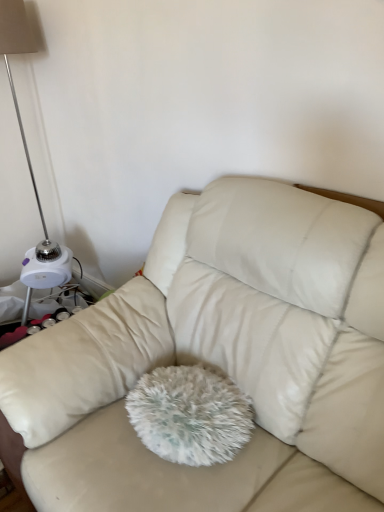
Question: In the image, is beige leather couch at center positioned in front of or behind white plastic lamp at left?

Choices:
 (A) behind
 (B) front

Answer: (B)

Question: Does point (269, 478) appear closer or farther from the camera than point (44, 268)?

Choices:
 (A) closer
 (B) farther

Answer: (A)

Question: From a real-world perspective, relative to white plastic lamp at left, is beige leather couch at center vertically above or below?

Choices:
 (A) below
 (B) above

Answer: (A)

Question: Considering their positions, is white plastic lamp at left located in front of or behind beige leather couch at center?

Choices:
 (A) front
 (B) behind

Answer: (B)

Question: In terms of height, does white plastic lamp at left look taller or shorter compared to beige leather couch at center?

Choices:
 (A) tall
 (B) short

Answer: (A)

Question: Based on their positions, is white plastic lamp at left located to the left or right of beige leather couch at center?

Choices:
 (A) left
 (B) right

Answer: (A)

Question: Based on their sizes in the image, would you say white plastic lamp at left is bigger or smaller than beige leather couch at center?

Choices:
 (A) big
 (B) small

Answer: (B)